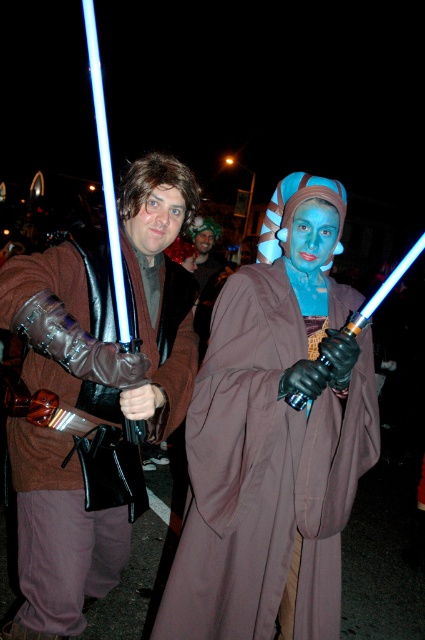
Is matte brown robe at center to the left of blue matte face at center from the viewer's perspective?

Correct, you'll find matte brown robe at center to the left of blue matte face at center.

Is point (223, 269) positioned in front of point (325, 237)?

No, it is behind (325, 237).

Which is behind, point (206, 250) or point (322, 262)?

Positioned behind is point (206, 250).

Locate an element on the screen. The width and height of the screenshot is (425, 640). matte brown robe at center is located at coordinates (206, 275).

Which is in front, point (91, 516) or point (178, 221)?

Point (91, 516)

How much distance is there between shiny silver lightsaber at center and matte brown hair at center?

shiny silver lightsaber at center is 15.81 inches away from matte brown hair at center.

Is point (164, 326) positioned before point (146, 237)?

That is False.

This screenshot has height=640, width=425. Identify the location of shiny silver lightsaber at center. (91, 403).

Who is lower down, blue matte/light brown robe at center or smooth skin face at center?

blue matte/light brown robe at center is lower down.

Is blue matte/light brown robe at center to the right of smooth skin face at center from the viewer's perspective?

Yes, blue matte/light brown robe at center is to the right of smooth skin face at center.

Is point (180, 582) positioned before point (204, 236)?

Yes, point (180, 582) is in front of point (204, 236).

The height and width of the screenshot is (640, 425). Find the location of `blue matte/light brown robe at center`. blue matte/light brown robe at center is located at coordinates (272, 445).